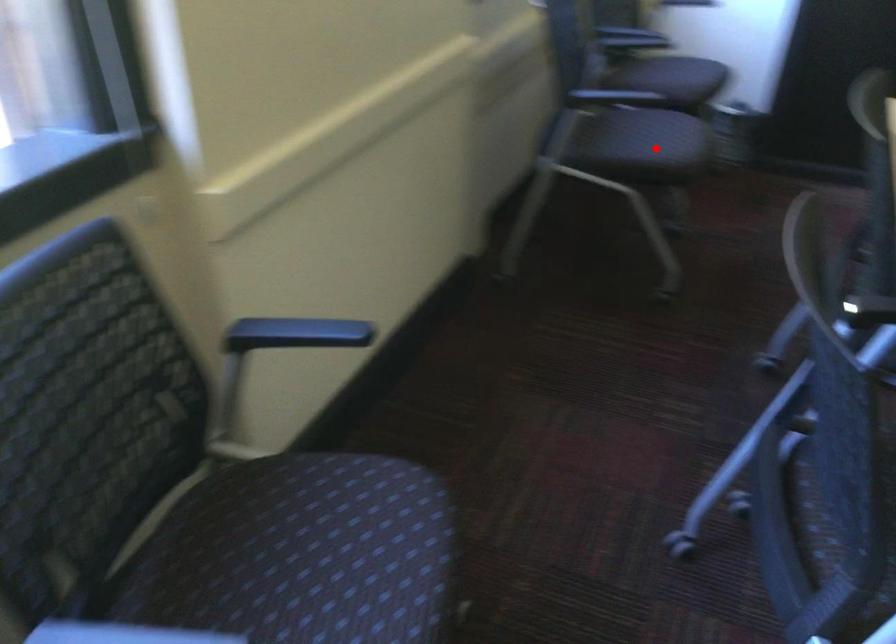
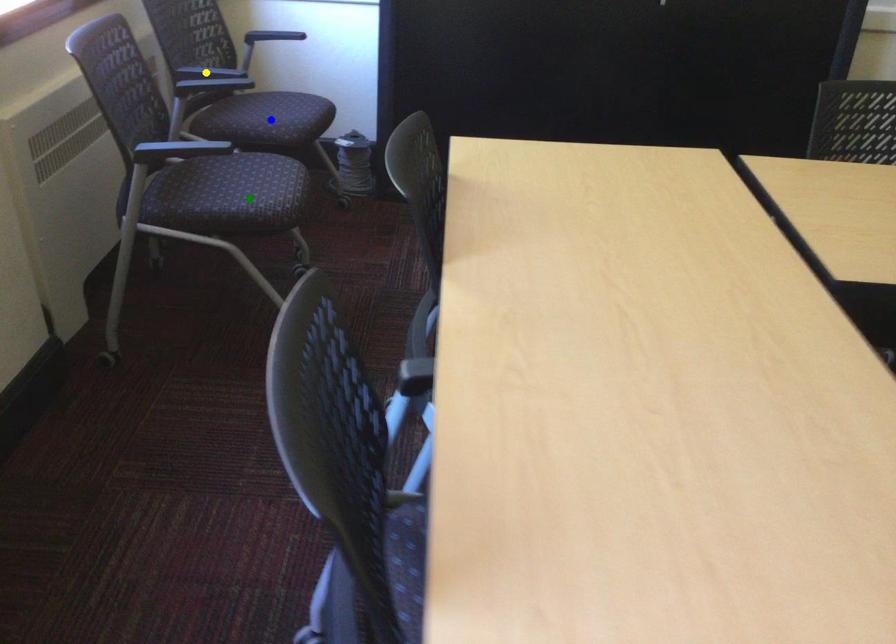
Question: I am providing you with two images of the same scene from different viewpoints. A red point is marked on the first image. You are given multiple points on the second image. Can you choose the point in image 2 that corresponds to the point in image 1?

Choices:
 (A) yellow point
 (B) green point
 (C) blue point

Answer: (B)